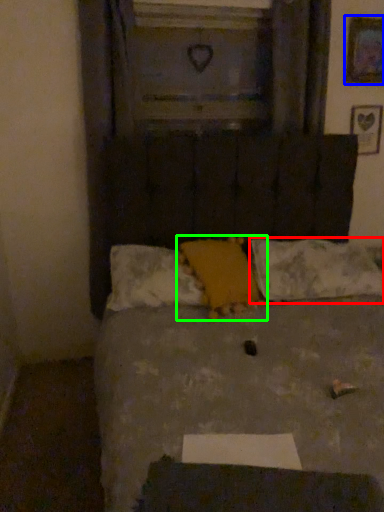
Question: Considering the real-world distances, which object is farthest from pillow (highlighted by a red box)? picture frame (highlighted by a blue box) or pillow (highlighted by a green box)?

Choices:
 (A) picture frame
 (B) pillow

Answer: (A)